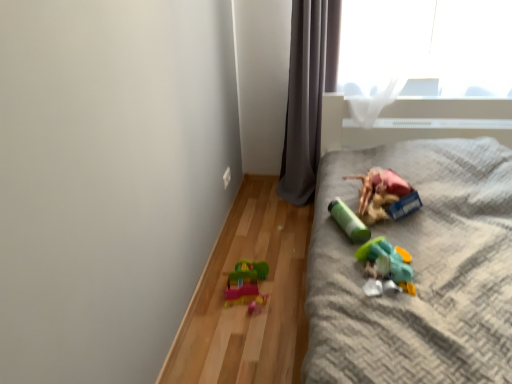
Identify the location of free space to the left of translucent plastic toy at lower left, acting as the fourth toy starting from the right. The image size is (512, 384). (210, 296).